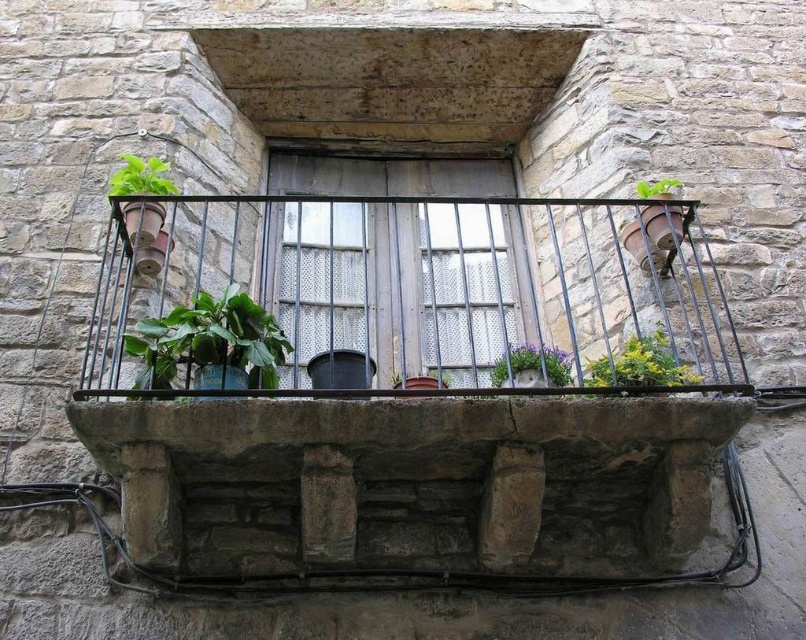
Question: Does green leafy plant at center have a greater width compared to green matte plant at upper left?

Choices:
 (A) yes
 (B) no

Answer: (A)

Question: Can you confirm if metallic grid at center is positioned below green matte plant at upper left?

Choices:
 (A) no
 (B) yes

Answer: (A)

Question: Does purple matte flower pot at center have a smaller size compared to green matte plant at upper left?

Choices:
 (A) no
 (B) yes

Answer: (A)

Question: Among these points, which one is nearest to the camera?

Choices:
 (A) (134, 193)
 (B) (376, 369)
 (C) (665, 380)
 (D) (667, 182)

Answer: (C)

Question: Which object appears closest to the camera in this image?

Choices:
 (A) green matte leafy plant at center
 (B) purple matte flower pot at center

Answer: (A)

Question: Based on their relative distances, which object is farther from the purple matte flower pot at center?

Choices:
 (A) green matte plant at upper left
 (B) green matte leafy plant at center
 (C) green matte plant at upper right
 (D) green leafy plants at center

Answer: (A)